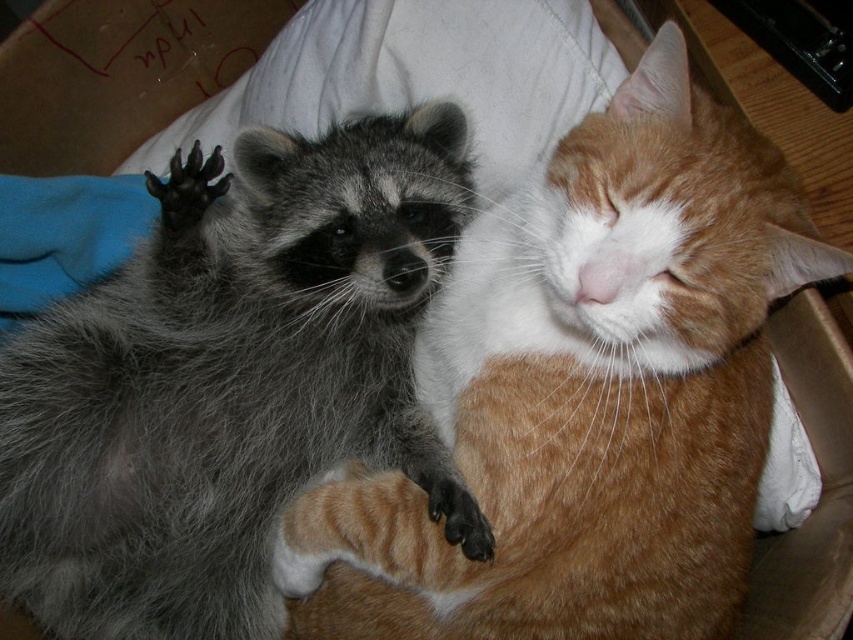
Is point (486, 596) farther from camera compared to point (86, 620)?

No, it is in front of (86, 620).

How distant is orange tabby cat at center from gray fur raccoon at upper left?

The distance of orange tabby cat at center from gray fur raccoon at upper left is 8.11 inches.

Who is more forward, (575, 561) or (86, 595)?

Point (575, 561) is more forward.

Locate an element on the screen. The height and width of the screenshot is (640, 853). orange tabby cat at center is located at coordinates (585, 392).